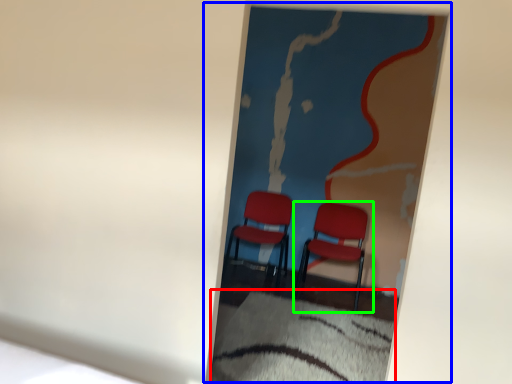
Question: Estimate the real-world distances between objects in this image. Which object is farther from sheet (highlighted by a red box), picture frame (highlighted by a blue box) or chair (highlighted by a green box)?

Choices:
 (A) picture frame
 (B) chair

Answer: (B)